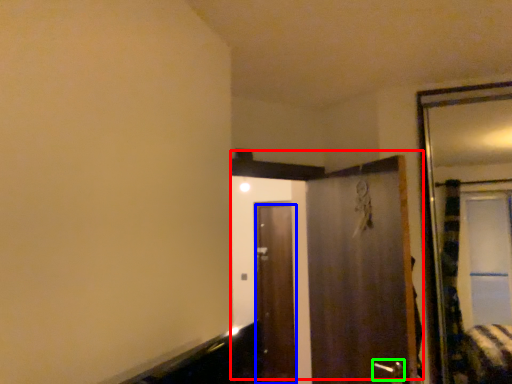
Question: Considering the real-world distances, which object is farthest from door (highlighted by a red box)? door (highlighted by a blue box) or door handle (highlighted by a green box)?

Choices:
 (A) door
 (B) door handle

Answer: (A)